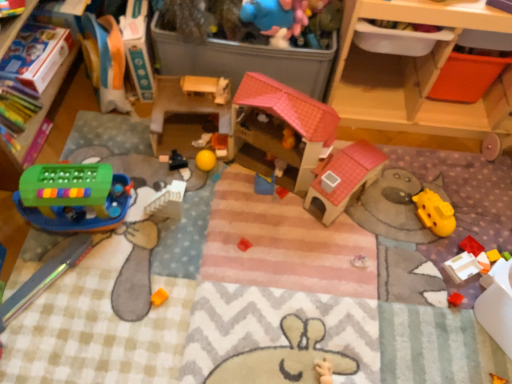
Identify the location of free location to the right of white plastic block at lower right, acting as the eighth toy starting from the left. Image resolution: width=512 pixels, height=384 pixels. (488, 254).